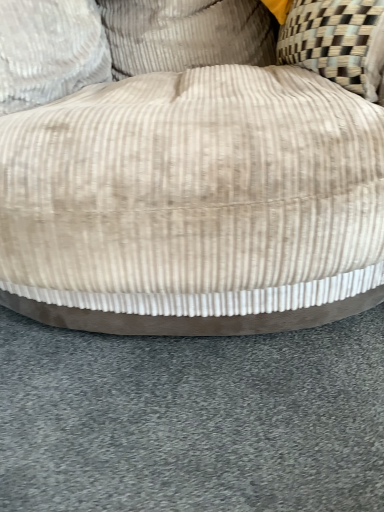
Question: Does beige corduroy pillow at upper center, positioned as the 1th pillow in right-to-left order, have a larger size compared to beige corduroy ottoman at center?

Choices:
 (A) yes
 (B) no

Answer: (B)

Question: Considering the relative sizes of beige corduroy pillow at upper center, positioned as the 1th pillow in right-to-left order, and beige corduroy ottoman at center in the image provided, is beige corduroy pillow at upper center, positioned as the 1th pillow in right-to-left order, wider than beige corduroy ottoman at center?

Choices:
 (A) yes
 (B) no

Answer: (B)

Question: Is beige corduroy pillow at upper center, the 2th pillow from the left, to the right of beige corduroy ottoman at center from the viewer's perspective?

Choices:
 (A) no
 (B) yes

Answer: (A)

Question: Can you confirm if beige corduroy pillow at upper center, positioned as the 1th pillow in right-to-left order, is thinner than beige corduroy ottoman at center?

Choices:
 (A) no
 (B) yes

Answer: (B)

Question: From a real-world perspective, does beige corduroy pillow at upper center, the 2th pillow from the left, stand above beige corduroy ottoman at center?

Choices:
 (A) no
 (B) yes

Answer: (B)

Question: Does point (130, 59) appear closer or farther from the camera than point (51, 50)?

Choices:
 (A) farther
 (B) closer

Answer: (A)

Question: In the image, is beige corduroy ottoman at center positioned in front of or behind beige corduroy pillow at upper left, the 2th pillow from the right?

Choices:
 (A) front
 (B) behind

Answer: (A)

Question: From the image's perspective, relative to beige corduroy pillow at upper left, the 2th pillow from the right, is beige corduroy ottoman at center above or below?

Choices:
 (A) below
 (B) above

Answer: (A)

Question: Is beige corduroy ottoman at center inside or outside of beige corduroy pillow at upper left, marked as the 1th pillow in a left-to-right arrangement?

Choices:
 (A) inside
 (B) outside

Answer: (B)

Question: From their relative heights in the image, would you say beige corduroy pillow at upper left, marked as the 1th pillow in a left-to-right arrangement, is taller or shorter than beige corduroy pillow at upper center, the 2th pillow from the left?

Choices:
 (A) tall
 (B) short

Answer: (B)

Question: From the image's perspective, relative to beige corduroy pillow at upper center, the 2th pillow from the left, is beige corduroy pillow at upper left, the 2th pillow from the right, above or below?

Choices:
 (A) below
 (B) above

Answer: (A)

Question: In terms of width, does beige corduroy pillow at upper left, the 2th pillow from the right, look wider or thinner when compared to beige corduroy pillow at upper center, the 2th pillow from the left?

Choices:
 (A) wide
 (B) thin

Answer: (A)

Question: Is beige corduroy pillow at upper left, the 2th pillow from the right, in front of or behind beige corduroy pillow at upper center, the 2th pillow from the left, in the image?

Choices:
 (A) behind
 (B) front

Answer: (B)

Question: Which is correct: beige corduroy ottoman at center is inside beige corduroy pillow at upper center, positioned as the 1th pillow in right-to-left order, or outside of it?

Choices:
 (A) outside
 (B) inside

Answer: (A)

Question: Considering the positions of beige corduroy ottoman at center and beige corduroy pillow at upper center, positioned as the 1th pillow in right-to-left order, in the image, is beige corduroy ottoman at center wider or thinner than beige corduroy pillow at upper center, positioned as the 1th pillow in right-to-left order,?

Choices:
 (A) thin
 (B) wide

Answer: (B)